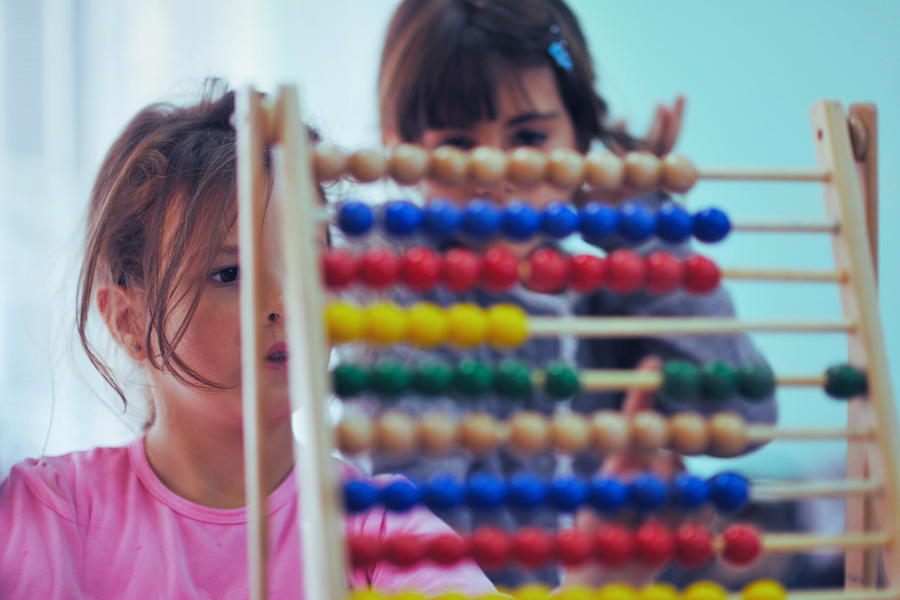
The width and height of the screenshot is (900, 600). I want to click on dowels on counting toy, so pyautogui.click(x=793, y=180), pyautogui.click(x=785, y=230), pyautogui.click(x=784, y=271), pyautogui.click(x=776, y=325), pyautogui.click(x=792, y=375), pyautogui.click(x=792, y=428), pyautogui.click(x=788, y=486), pyautogui.click(x=819, y=544), pyautogui.click(x=824, y=591).